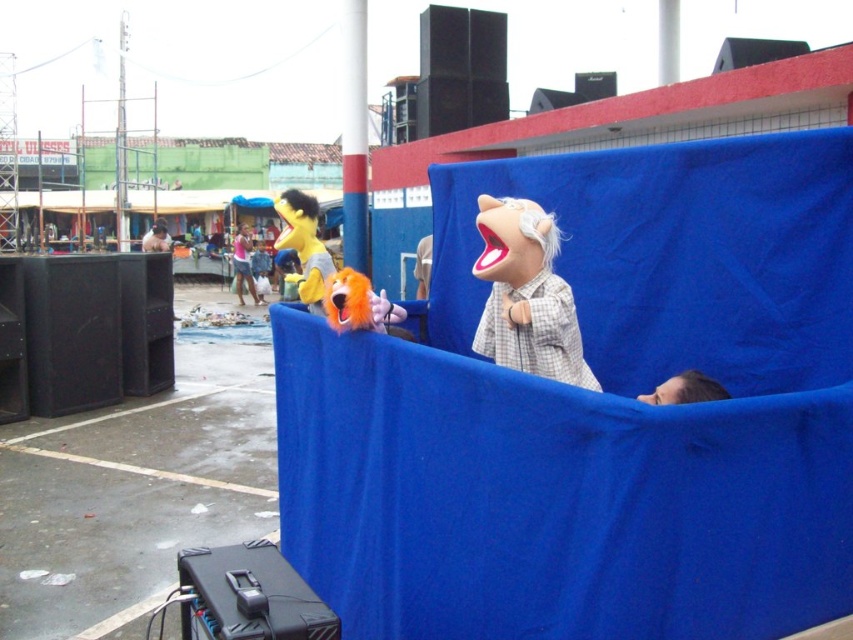
You are a stagehand setting up for a puppet show. You need to place a new puppet exactly at point [526,294]. According to the scene, what is already present at that location?

The plush textile puppet at center is already located at point [526,294].